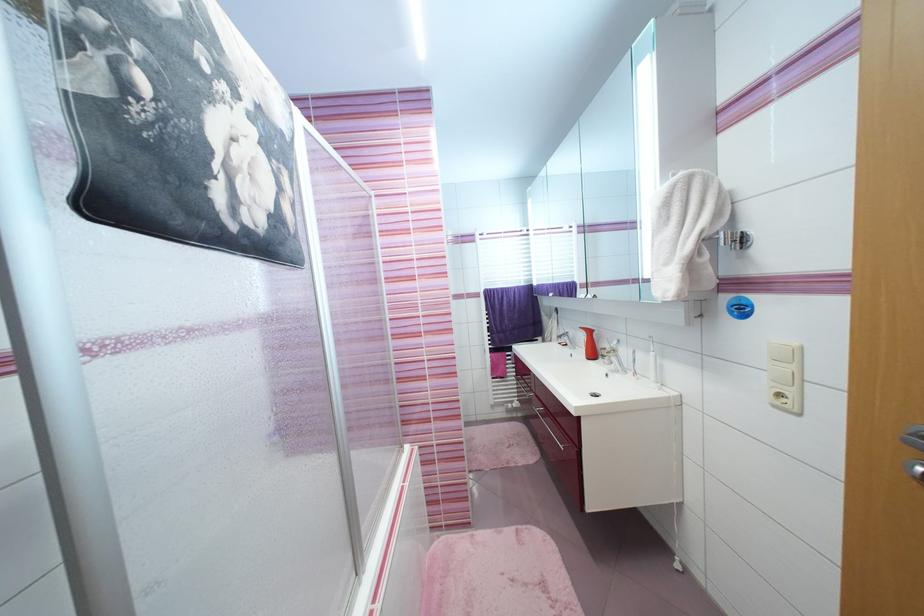
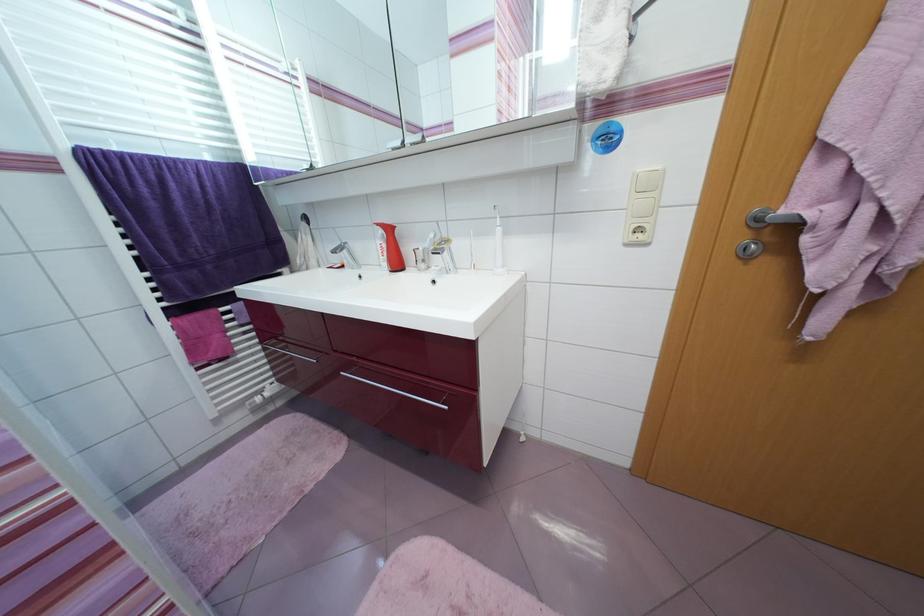
The point at (610, 350) is marked in the first image. Where is the corresponding point in the second image?

(423, 251)